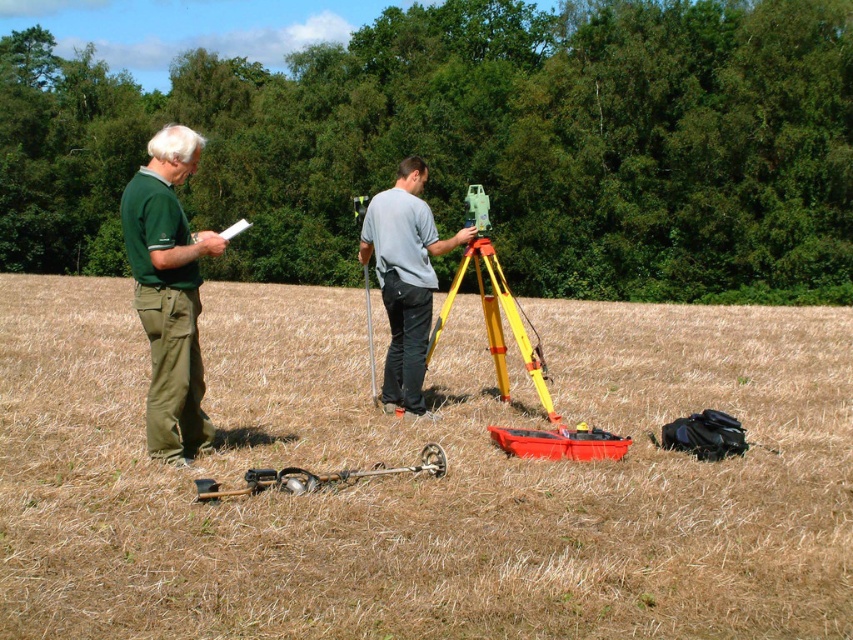
You are a fieldworker who just arrived at the scene and need to locate your green cotton pants at left. According to the coordinates provided, where exactly should you look for it?

The green cotton pants at left can be found at the coordinates point (167, 292).

You are a field assistant standing at the surveying instrument on the tripod. You need to retrieve an accessory from the point located at coordinate [171,413]. Can you reach it without moving from your current position?

The distance of point [171,413] from viewer is 5.75 meters. Since you are at the surveying instrument on the tripod and the point is 5.75 meters away, you cannot reach it without moving closer.